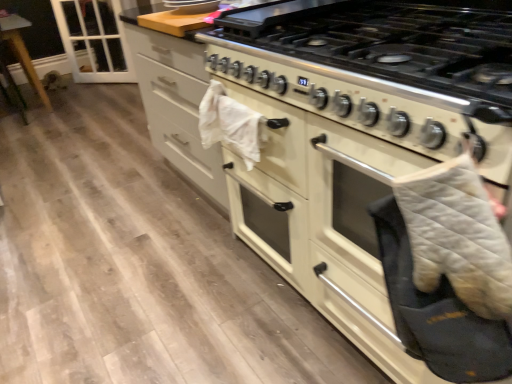
Question: Can you confirm if transparent glass door at upper left is smaller than gray quilted oven mitt at right?

Choices:
 (A) yes
 (B) no

Answer: (B)

Question: Is transparent glass door at upper left positioned behind gray quilted oven mitt at right?

Choices:
 (A) yes
 (B) no

Answer: (A)

Question: Considering the relative positions of transparent glass door at upper left and gray quilted oven mitt at right in the image provided, is transparent glass door at upper left to the right of gray quilted oven mitt at right from the viewer's perspective?

Choices:
 (A) yes
 (B) no

Answer: (B)

Question: Is the depth of transparent glass door at upper left less than that of gray quilted oven mitt at right?

Choices:
 (A) no
 (B) yes

Answer: (A)

Question: From the image's perspective, does transparent glass door at upper left appear higher than gray quilted oven mitt at right?

Choices:
 (A) no
 (B) yes

Answer: (B)

Question: Is transparent glass door at upper left turned away from gray quilted oven mitt at right?

Choices:
 (A) yes
 (B) no

Answer: (B)

Question: Considering the relative sizes of white quilted oven mitt at right and white glossy gas stove at center in the image provided, is white quilted oven mitt at right shorter than white glossy gas stove at center?

Choices:
 (A) no
 (B) yes

Answer: (A)

Question: Is white quilted oven mitt at right at the right side of white glossy gas stove at center?

Choices:
 (A) yes
 (B) no

Answer: (B)

Question: Does white quilted oven mitt at right come behind white glossy gas stove at center?

Choices:
 (A) yes
 (B) no

Answer: (B)

Question: From the image's perspective, is white quilted oven mitt at right beneath white glossy gas stove at center?

Choices:
 (A) yes
 (B) no

Answer: (A)

Question: From a real-world perspective, is white quilted oven mitt at right located beneath white glossy gas stove at center?

Choices:
 (A) no
 (B) yes

Answer: (B)

Question: Is white quilted oven mitt at right aimed at white glossy gas stove at center?

Choices:
 (A) yes
 (B) no

Answer: (B)

Question: From a real-world perspective, is white glossy gas stove at center physically above gray quilted oven mitt at right?

Choices:
 (A) yes
 (B) no

Answer: (A)